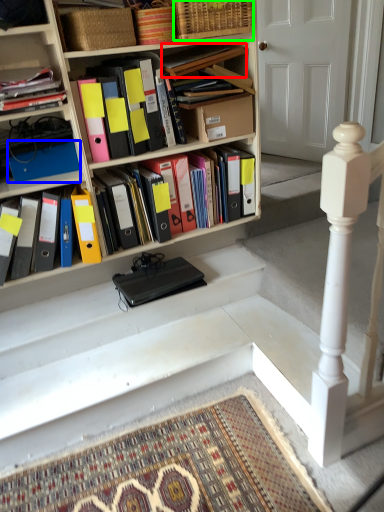
Question: Which object is the farthest from book (highlighted by a red box)? Choose among these: paperback book (highlighted by a blue box) or basket (highlighted by a green box).

Choices:
 (A) paperback book
 (B) basket

Answer: (A)